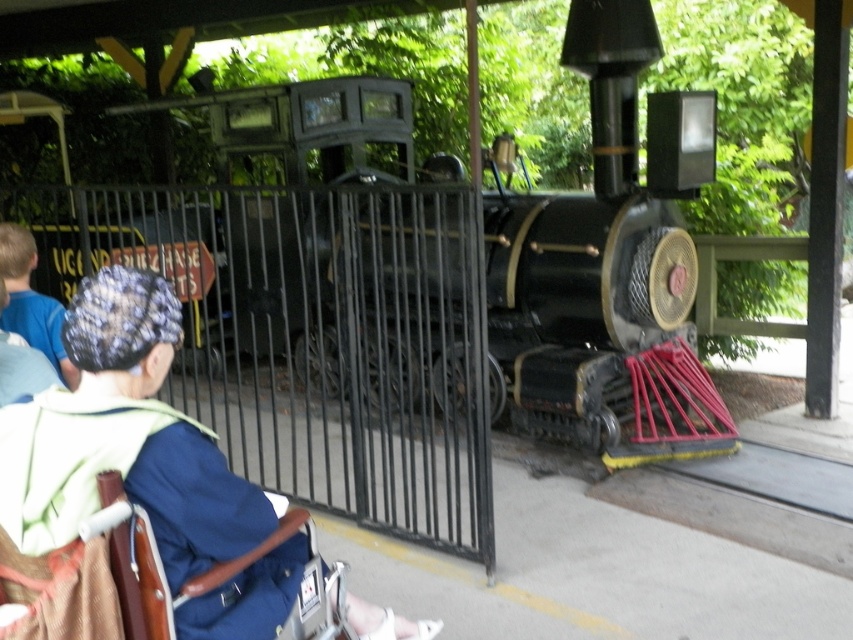
Can you confirm if polished black locomotive at center is positioned to the left of blue fabric jacket at lower left?

In fact, polished black locomotive at center is to the right of blue fabric jacket at lower left.

Can you confirm if polished black locomotive at center is wider than blue fabric jacket at lower left?

Correct, the width of polished black locomotive at center exceeds that of blue fabric jacket at lower left.

Does point (509, 214) lie in front of point (39, 536)?

No, it is behind (39, 536).

Image resolution: width=853 pixels, height=640 pixels. I want to click on polished black locomotive at center, so (610, 260).

Describe the element at coordinates (610, 260) in the screenshot. I see `polished black locomotive at center` at that location.

Can you confirm if polished black locomotive at center is wider than blue fabric cap at upper left?

Correct, the width of polished black locomotive at center exceeds that of blue fabric cap at upper left.

Is point (593, 216) positioned before point (74, 381)?

No, (593, 216) is further to viewer.

Locate an element on the screen. polished black locomotive at center is located at coordinates (610, 260).

Is blue fabric jacket at lower left taller than blue fabric cap at upper left?

Correct, blue fabric jacket at lower left is much taller as blue fabric cap at upper left.

Find the location of `blue fabric jacket at lower left`. blue fabric jacket at lower left is located at coordinates coord(125,436).

Find the location of a particular element. The width and height of the screenshot is (853, 640). blue fabric jacket at lower left is located at coordinates (125, 436).